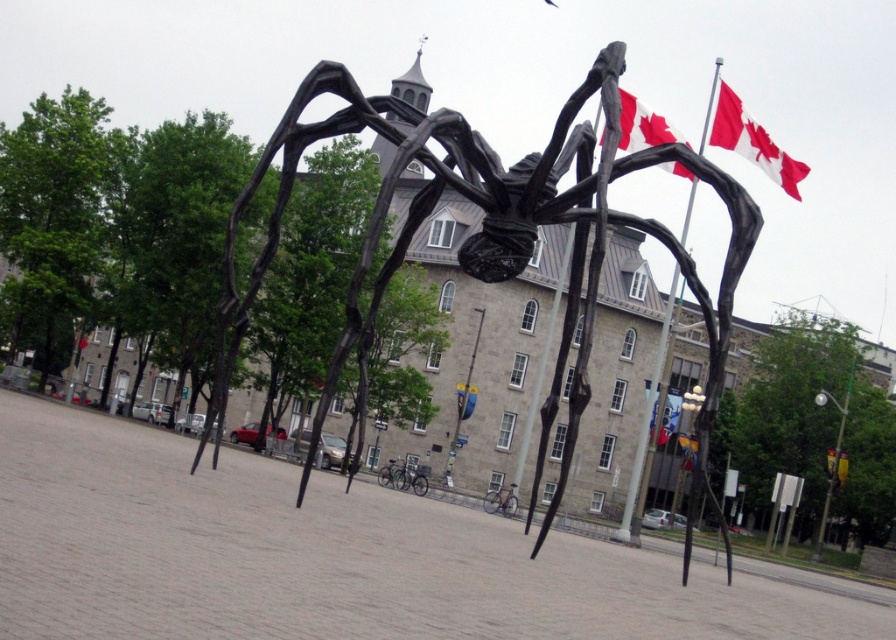
You are standing in front of the spider sculpture and looking at the two points marked on it. Which point, point [640,109] or point [669,429], is closer to you?

Point [640,109] is closer to the camera than point [669,429], so it is closer to you.

You are standing in the plaza facing the spider sculpture. You see a point marked at coordinates (752, 141). What object does this point correspond to?

The point at coordinates (752, 141) corresponds to the red fabric flag at upper right.